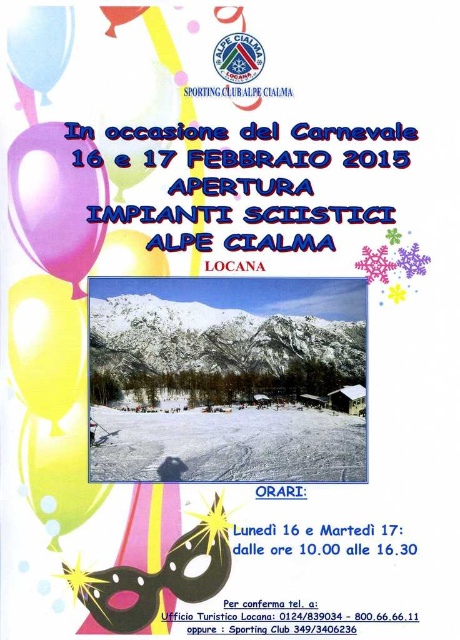
You are looking at the promotional poster for Alpe Cialma. There are two points marked on the poster. The first point is at coordinates point [217,289] and the second is at point [50,12]. If you were to touch both points with your finger, which point would you need to reach out further towards the poster?

Point [217,289] is further to the camera than point [50,12], so you would need to reach out further towards the poster to touch point [217,289].

You are organizing a photo shoot at the Alpe Cialma ski resort and need to position two balloons for the event. The yellow matte balloon at lower left and the matte blue balloon at upper left are already placed. The photographer wants to know if there is enough space between them for a 30 inch wide camera setup. Can you confirm?

The distance between the yellow matte balloon at lower left and the matte blue balloon at upper left is 33.25 inches, which is sufficient to accommodate a 30 inch wide camera setup.

You are planning to take a photo of the snowy white mountain at center and the pink glossy balloon at upper left for the event poster. Which object should you focus on first if you want to capture both in a single frame without zooming in or out?

The snowy white mountain at center is larger in size than the pink glossy balloon at upper left, so you should focus on the snowy white mountain at center first to ensure it fits properly in the frame before adjusting for the smaller balloon.